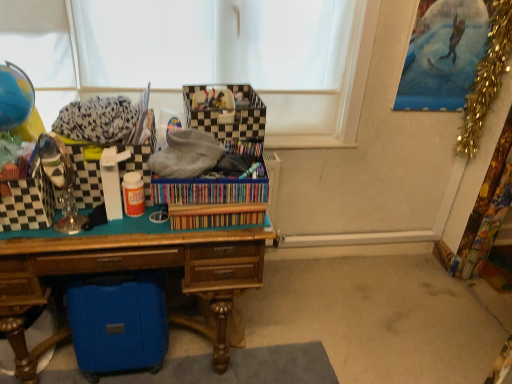
The image size is (512, 384). I want to click on checkered fabric storage box at center, which appears as the first storage box when viewed from the top, so click(232, 116).

This screenshot has width=512, height=384. Describe the element at coordinates (85, 178) in the screenshot. I see `checkered plastic storage box at left, the third storage box positioned from the bottom` at that location.

Image resolution: width=512 pixels, height=384 pixels. Find the location of `checkered plastic storage box at left, the 2th storage box in the bottom-to-top sequence`. checkered plastic storage box at left, the 2th storage box in the bottom-to-top sequence is located at coordinates (27, 203).

The width and height of the screenshot is (512, 384). Find the location of `gold tinsel garland at upper right`. gold tinsel garland at upper right is located at coordinates (487, 78).

Locate an element on the screen. This screenshot has height=384, width=512. blue fabric suitcase at lower left, positioned as the 4th storage box in top-to-bottom order is located at coordinates (118, 322).

Locate an element on the screen. This screenshot has height=384, width=512. desk that appears below the checkered plastic storage box at left, which is the 3th storage box from top to bottom (from a real-world perspective) is located at coordinates coord(128,270).

Considering the sizes of wooden desk at center and checkered plastic storage box at left, the 2th storage box in the bottom-to-top sequence, in the image, is wooden desk at center wider or thinner than checkered plastic storage box at left, the 2th storage box in the bottom-to-top sequence,?

wooden desk at center is wider than checkered plastic storage box at left, the 2th storage box in the bottom-to-top sequence.

Consider the image. Can you tell me how much wooden desk at center and checkered plastic storage box at left, the 2th storage box in the bottom-to-top sequence, differ in facing direction?

They differ by 4.28 degrees in their facing directions.

From the image's perspective, is wooden desk at center above checkered plastic storage box at left, the 2th storage box in the bottom-to-top sequence?

No, from the image's perspective, wooden desk at center is not over checkered plastic storage box at left, the 2th storage box in the bottom-to-top sequence.

Consider the image. From the image's perspective, is blue fabric suitcase at lower left, positioned as the 4th storage box in top-to-bottom order, located above wooden desk at center?

Actually, blue fabric suitcase at lower left, positioned as the 4th storage box in top-to-bottom order, appears below wooden desk at center in the image.

Is point (105, 311) closer to camera compared to point (32, 266)?

No, it is behind (32, 266).

Does blue fabric suitcase at lower left, positioned as the 4th storage box in top-to-bottom order, appear on the left side of wooden desk at center?

Incorrect, blue fabric suitcase at lower left, positioned as the 4th storage box in top-to-bottom order, is not on the left side of wooden desk at center.

Is wooden desk at center at the back of blue fabric suitcase at lower left, positioned as the 4th storage box in top-to-bottom order?

Yes, blue fabric suitcase at lower left, positioned as the 4th storage box in top-to-bottom order,'s orientation is away from wooden desk at center.

Is checkered plastic storage box at left, which is the 3th storage box from top to bottom, to the left or to the right of checkered fabric storage box at center, which appears as the first storage box when viewed from the top, in the image?

From the image, it's evident that checkered plastic storage box at left, which is the 3th storage box from top to bottom, is to the left of checkered fabric storage box at center, which appears as the first storage box when viewed from the top.

From the checkered fabric storage box at center, acting as the fourth storage box starting from the bottom, count the 3rd storage box to the left and point to it. Please provide its 2D coordinates.

[(27, 203)]

Is checkered plastic storage box at left, which is the 3th storage box from top to bottom, further to camera compared to checkered fabric storage box at center, which appears as the first storage box when viewed from the top?

No, checkered plastic storage box at left, which is the 3th storage box from top to bottom, is closer to the viewer.

Who is smaller, checkered plastic storage box at left, the 2th storage box in the bottom-to-top sequence, or checkered fabric storage box at center, which appears as the first storage box when viewed from the top?

checkered plastic storage box at left, the 2th storage box in the bottom-to-top sequence, is smaller.

In the scene shown: Are checkered plastic storage box at left, which ranks as the second storage box in top-to-bottom order, and checkered plastic storage box at left, the 2th storage box in the bottom-to-top sequence, located far from each other?

checkered plastic storage box at left, which ranks as the second storage box in top-to-bottom order, is actually quite close to checkered plastic storage box at left, the 2th storage box in the bottom-to-top sequence.

Which is behind, point (80, 152) or point (29, 227)?

The point (80, 152) is farther from the camera.

Do you think checkered plastic storage box at left, which ranks as the second storage box in top-to-bottom order, is within checkered plastic storage box at left, which is the 3th storage box from top to bottom, or outside of it?

checkered plastic storage box at left, which ranks as the second storage box in top-to-bottom order, lies outside checkered plastic storage box at left, which is the 3th storage box from top to bottom.

Is checkered plastic storage box at left, which ranks as the second storage box in top-to-bottom order, positioned in front of checkered plastic storage box at left, which is the 3th storage box from top to bottom?

No, the depth of checkered plastic storage box at left, which ranks as the second storage box in top-to-bottom order, is greater than that of checkered plastic storage box at left, which is the 3th storage box from top to bottom.

Does wooden desk at center have a lesser height compared to checkered fabric storage box at center, which appears as the first storage box when viewed from the top?

No, wooden desk at center is not shorter than checkered fabric storage box at center, which appears as the first storage box when viewed from the top.

From a real-world perspective, is wooden desk at center located higher than checkered fabric storage box at center, which appears as the first storage box when viewed from the top?

Incorrect, from a real-world perspective, wooden desk at center is lower than checkered fabric storage box at center, which appears as the first storage box when viewed from the top.

Is wooden desk at center not near checkered fabric storage box at center, which appears as the first storage box when viewed from the top?

wooden desk at center is near checkered fabric storage box at center, which appears as the first storage box when viewed from the top, not far away.

Is wooden desk at center at the right side of checkered fabric storage box at center, acting as the fourth storage box starting from the bottom?

Incorrect, wooden desk at center is not on the right side of checkered fabric storage box at center, acting as the fourth storage box starting from the bottom.

Does gold tinsel garland at upper right turn towards blue fabric suitcase at lower left, positioned as the 4th storage box in top-to-bottom order?

No, gold tinsel garland at upper right is not turned towards blue fabric suitcase at lower left, positioned as the 4th storage box in top-to-bottom order.

Is gold tinsel garland at upper right located outside blue fabric suitcase at lower left, the first storage box positioned from the bottom?

Yes, gold tinsel garland at upper right is outside of blue fabric suitcase at lower left, the first storage box positioned from the bottom.

Is point (490, 18) less distant than point (86, 304)?

No, (490, 18) is further to viewer.

Considering their positions, is gold tinsel garland at upper right located in front of or behind blue fabric suitcase at lower left, the first storage box positioned from the bottom?

Clearly, gold tinsel garland at upper right is behind blue fabric suitcase at lower left, the first storage box positioned from the bottom.

Based on the photo, considering the relative sizes of blue fabric suitcase at lower left, the first storage box positioned from the bottom, and checkered fabric storage box at center, which appears as the first storage box when viewed from the top, in the image provided, is blue fabric suitcase at lower left, the first storage box positioned from the bottom, taller than checkered fabric storage box at center, which appears as the first storage box when viewed from the top,?

Yes, blue fabric suitcase at lower left, the first storage box positioned from the bottom, is taller than checkered fabric storage box at center, which appears as the first storage box when viewed from the top.

Is point (78, 303) more distant than point (251, 124)?

No.

Considering the sizes of blue fabric suitcase at lower left, the first storage box positioned from the bottom, and checkered fabric storage box at center, which appears as the first storage box when viewed from the top, in the image, is blue fabric suitcase at lower left, the first storage box positioned from the bottom, wider or thinner than checkered fabric storage box at center, which appears as the first storage box when viewed from the top,?

blue fabric suitcase at lower left, the first storage box positioned from the bottom, is thinner than checkered fabric storage box at center, which appears as the first storage box when viewed from the top.

Which is more to the left, blue fabric suitcase at lower left, positioned as the 4th storage box in top-to-bottom order, or checkered fabric storage box at center, which appears as the first storage box when viewed from the top?

Positioned to the left is blue fabric suitcase at lower left, positioned as the 4th storage box in top-to-bottom order.

You are a GUI agent. You are given a task and a screenshot of the screen. Output one action in this format:
    pyautogui.click(x=<x>, y=<y>)
    Task: Click on the desk below the checkered plastic storage box at left, the 2th storage box in the bottom-to-top sequence (from a real-world perspective)
    The width and height of the screenshot is (512, 384).
    Given the screenshot: What is the action you would take?
    pyautogui.click(x=128, y=270)

Starting from the wooden desk at center, which storage box is the 3rd one behind? Please provide its 2D coordinates.

[(118, 322)]

From the picture: From the image, which object appears to be nearer to checkered plastic storage box at left, which ranks as the second storage box in top-to-bottom order, checkered fabric storage box at center, acting as the fourth storage box starting from the bottom, or wooden desk at center?

wooden desk at center lies closer to checkered plastic storage box at left, which ranks as the second storage box in top-to-bottom order, than the other object.

From the image, which object appears to be farther from wooden desk at center, checkered plastic storage box at left, which ranks as the second storage box in top-to-bottom order, or checkered fabric storage box at center, which appears as the first storage box when viewed from the top?

checkered fabric storage box at center, which appears as the first storage box when viewed from the top.

Looking at the image, which one is located further to checkered plastic storage box at left, which is the 3th storage box from top to bottom, checkered fabric storage box at center, which appears as the first storage box when viewed from the top, or checkered plastic storage box at left, which ranks as the second storage box in top-to-bottom order?

checkered fabric storage box at center, which appears as the first storage box when viewed from the top, lies further to checkered plastic storage box at left, which is the 3th storage box from top to bottom, than the other object.

From the image, which object appears to be nearer to gold tinsel garland at upper right, wooden desk at center or checkered plastic storage box at left, the third storage box positioned from the bottom?

wooden desk at center is positioned closer to the anchor gold tinsel garland at upper right.

When comparing their distances from blue fabric suitcase at lower left, positioned as the 4th storage box in top-to-bottom order, does checkered fabric storage box at center, acting as the fourth storage box starting from the bottom, or checkered plastic storage box at left, the 2th storage box in the bottom-to-top sequence, seem closer?

The object closer to blue fabric suitcase at lower left, positioned as the 4th storage box in top-to-bottom order, is checkered plastic storage box at left, the 2th storage box in the bottom-to-top sequence.

Consider the image. Based on their spatial positions, is checkered plastic storage box at left, the third storage box positioned from the bottom, or gold tinsel garland at upper right closer to blue fabric suitcase at lower left, positioned as the 4th storage box in top-to-bottom order?

Among the two, checkered plastic storage box at left, the third storage box positioned from the bottom, is located nearer to blue fabric suitcase at lower left, positioned as the 4th storage box in top-to-bottom order.

Estimate the real-world distances between objects in this image. Which object is closer to checkered plastic storage box at left, which is the 3th storage box from top to bottom, gold tinsel garland at upper right or checkered fabric storage box at center, which appears as the first storage box when viewed from the top?

checkered fabric storage box at center, which appears as the first storage box when viewed from the top, is closer to checkered plastic storage box at left, which is the 3th storage box from top to bottom.

Considering their positions, is wooden desk at center positioned closer to checkered plastic storage box at left, which is the 3th storage box from top to bottom, than blue fabric suitcase at lower left, the first storage box positioned from the bottom?

Among the two, wooden desk at center is located nearer to checkered plastic storage box at left, which is the 3th storage box from top to bottom.

Find the location of a particular element. desk between checkered plastic storage box at left, which is the 3th storage box from top to bottom, and gold tinsel garland at upper right, in the horizontal direction is located at coordinates (128, 270).

This screenshot has width=512, height=384. I want to click on storage box between checkered plastic storage box at left, which ranks as the second storage box in top-to-bottom order, and blue fabric suitcase at lower left, positioned as the 4th storage box in top-to-bottom order, vertically, so click(x=27, y=203).

Find the location of `storage box between checkered plastic storage box at left, the third storage box positioned from the bottom, and wooden desk at center in the up-down direction`. storage box between checkered plastic storage box at left, the third storage box positioned from the bottom, and wooden desk at center in the up-down direction is located at coordinates (27, 203).

This screenshot has height=384, width=512. Find the location of `storage box located between blue fabric suitcase at lower left, the first storage box positioned from the bottom, and gold tinsel garland at upper right in the left-right direction`. storage box located between blue fabric suitcase at lower left, the first storage box positioned from the bottom, and gold tinsel garland at upper right in the left-right direction is located at coordinates (232, 116).